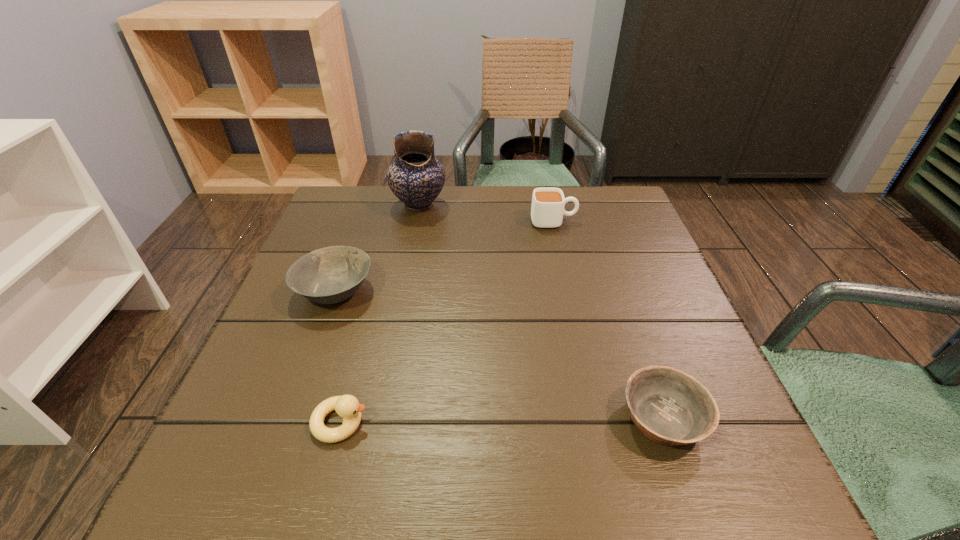
Identify the location of blank region between the cup and the tallest object. (487, 213).

You are a GUI agent. You are given a task and a screenshot of the screen. Output one action in this format:
    pyautogui.click(x=<x>, y=<y>)
    Task: Click on the free space between the left bowl and the shorter bowl
    
    Given the screenshot: What is the action you would take?
    pyautogui.click(x=499, y=354)

You are a GUI agent. You are given a task and a screenshot of the screen. Output one action in this format:
    pyautogui.click(x=<x>, y=<y>)
    Task: Click on the free area in between the nearer bowl and the taller bowl
    
    Given the screenshot: What is the action you would take?
    pyautogui.click(x=499, y=354)

The image size is (960, 540). I want to click on blank region between the duckling and the fourth shortest object, so click(447, 322).

I want to click on free area in between the tallest object and the shortest object, so click(x=541, y=312).

Image resolution: width=960 pixels, height=540 pixels. Find the location of `free space between the pottery and the fourth shortest object`. free space between the pottery and the fourth shortest object is located at coordinates (487, 213).

The height and width of the screenshot is (540, 960). I want to click on free spot between the pottery and the shortest object, so click(541, 312).

I want to click on the third closest object to the shortest object, so click(x=330, y=275).

Choose which object is the nearest neighbor to the shorter bowl. Please provide its 2D coordinates. Your answer should be formatted as a tuple, i.e. [(x, y)], where the tuple contains the x and y coordinates of a point satisfying the conditions above.

[(347, 406)]

At what (x,y) coordinates should I click in order to perform the action: click on vacant area in the image that satisfies the following two spatial constraints: 1. on the front side of the right bowl; 2. on the right side of the tallest object. Please return your answer as a coordinate pair (x, y). The height and width of the screenshot is (540, 960). Looking at the image, I should click on (377, 418).